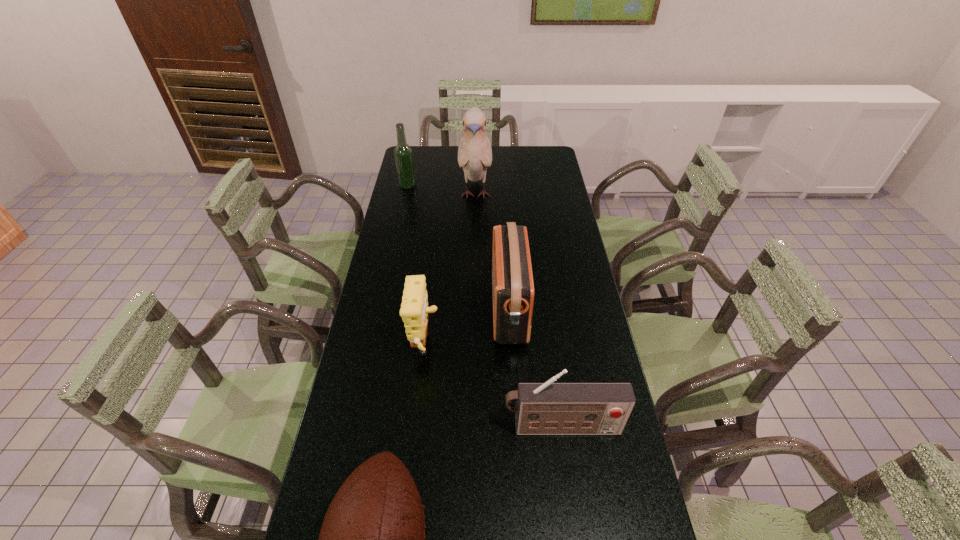
This screenshot has width=960, height=540. I want to click on the tallest object, so click(x=474, y=153).

Identify the location of liquor. coord(403,154).

Identify the location of the farther radio receiver. The width and height of the screenshot is (960, 540). (512, 279).

Locate an element on the screen. the second nearest object is located at coordinates (548, 408).

Where is `sponge`? sponge is located at coordinates [x=414, y=310].

Where is `vacant region located on the face of the parakeet`? The image size is (960, 540). vacant region located on the face of the parakeet is located at coordinates (474, 249).

At what (x,y) coordinates should I click in order to perform the action: click on vacant space located 0.380m on the right of the liquor. Please return your answer as a coordinate pair (x, y). Looking at the image, I should click on (501, 185).

Locate an element on the screen. This screenshot has width=960, height=540. free space located on the front-facing side of the farther radio receiver is located at coordinates click(x=416, y=309).

Find the location of `vacant space located 0.060m on the front-facing side of the farther radio receiver`. vacant space located 0.060m on the front-facing side of the farther radio receiver is located at coordinates (474, 309).

Identify the location of free space located on the front-facing side of the farther radio receiver. This screenshot has width=960, height=540. (468, 309).